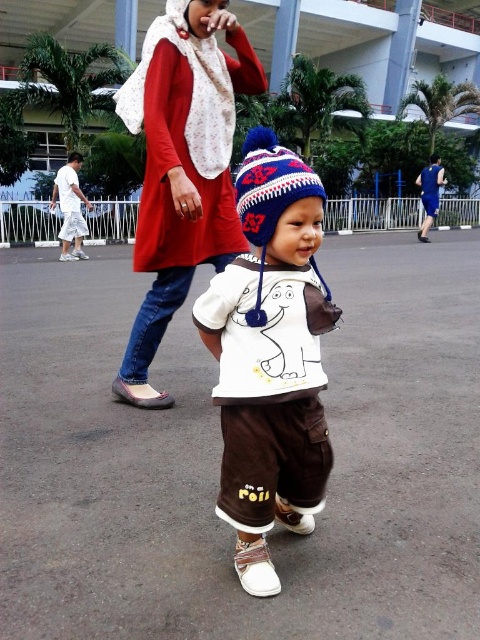
Question: Is matte red dress at center behind white cotton shirt at left?

Choices:
 (A) no
 (B) yes

Answer: (A)

Question: Can you confirm if matte red dress at center is thinner than white cotton shirt at left?

Choices:
 (A) no
 (B) yes

Answer: (B)

Question: Among these objects, which one is nearest to the camera?

Choices:
 (A) matte red dress at center
 (B) knitted woolen hat at center
 (C) white cotton shirt at center
 (D) white cotton shirt at left

Answer: (C)

Question: Among these objects, which one is nearest to the camera?

Choices:
 (A) matte red dress at center
 (B) white cotton shirt at center
 (C) knitted woolen hat at center
 (D) white cotton shirt at left

Answer: (B)

Question: Which object appears closest to the camera in this image?

Choices:
 (A) white cotton shirt at center
 (B) white cotton shirt at left
 (C) matte red dress at center
 (D) knitted woolen hat at center

Answer: (A)

Question: Does matte red dress at center have a lesser width compared to white cotton shirt at left?

Choices:
 (A) yes
 (B) no

Answer: (A)